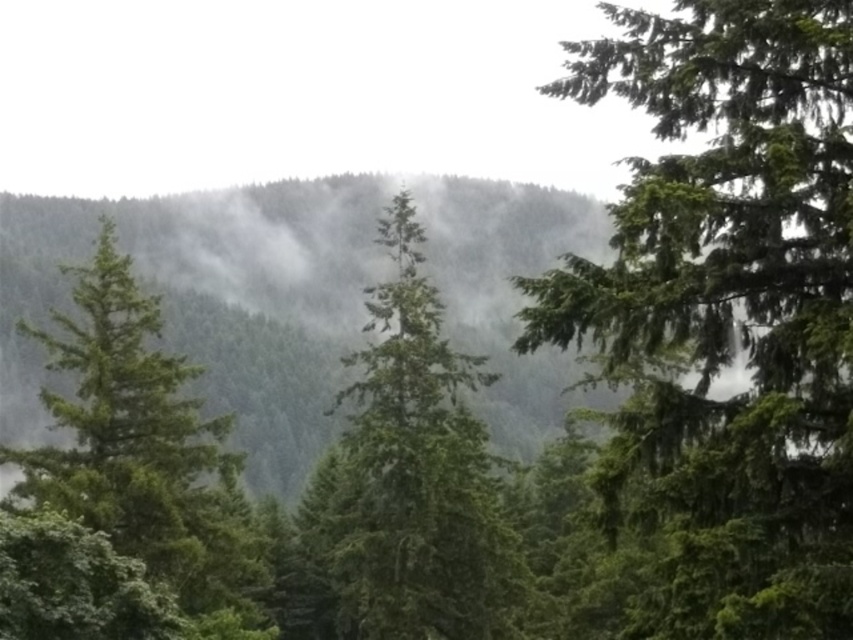
Question: Is green matte tree at center bigger than green matte tree at left?

Choices:
 (A) yes
 (B) no

Answer: (B)

Question: Which point is farther to the camera?

Choices:
 (A) green matte tree at center
 (B) green matte tree at left

Answer: (A)

Question: Is green matte tree at upper right to the right of green matte tree at center from the viewer's perspective?

Choices:
 (A) no
 (B) yes

Answer: (B)

Question: Can you confirm if green matte tree at upper right is thinner than green matte tree at left?

Choices:
 (A) yes
 (B) no

Answer: (A)

Question: Estimate the real-world distances between objects in this image. Which object is closer to the green matte tree at upper right?

Choices:
 (A) green matte tree at center
 (B) green matte tree at left

Answer: (B)

Question: Which is nearer to the green matte tree at center?

Choices:
 (A) green matte tree at left
 (B) green matte tree at upper right

Answer: (A)